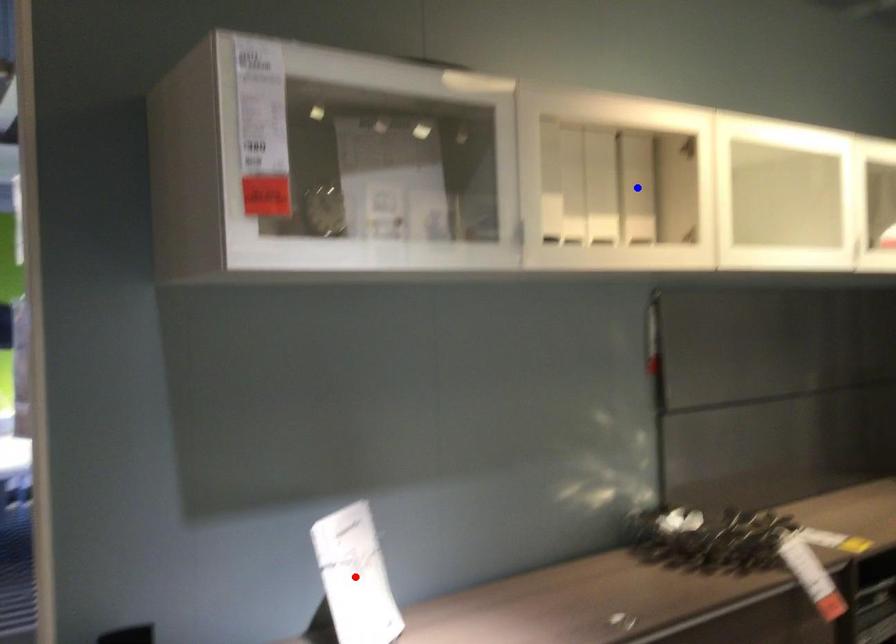
Question: In the image, two points are highlighted. Which point is nearer to the camera? Reply with the corresponding letter.

Choices:
 (A) blue point
 (B) red point

Answer: (B)